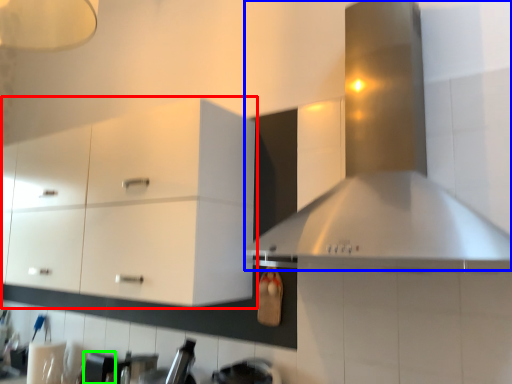
Question: Which object is positioned farthest from cabinetry (highlighted by a red box)? Select from vent (highlighted by a blue box) and appliance (highlighted by a green box).

Choices:
 (A) vent
 (B) appliance

Answer: (B)